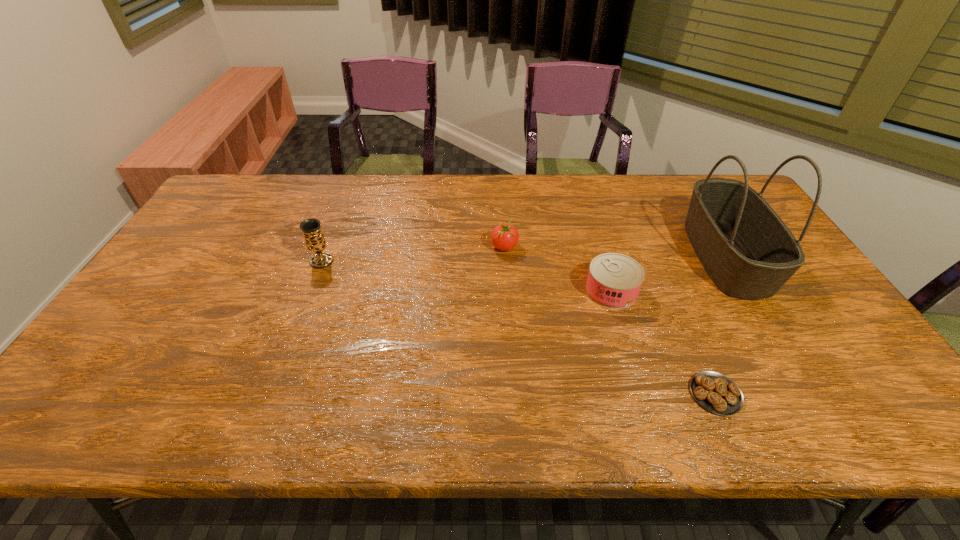
What are the coordinates of `free location located 0.340m on the front of the fourth object from right to left` in the screenshot? It's located at (511, 348).

Where is `vacant space situated 0.380m on the right of the can`? vacant space situated 0.380m on the right of the can is located at coordinates (775, 291).

Where is `free space located 0.160m on the left of the pastry`? free space located 0.160m on the left of the pastry is located at coordinates (619, 394).

Identify the location of object that is at the near edge. This screenshot has height=540, width=960. (715, 392).

Where is `object located in the right edge section of the desktop`? This screenshot has height=540, width=960. object located in the right edge section of the desktop is located at coordinates (747, 250).

This screenshot has height=540, width=960. Find the location of `vacant space at the far edge of the desktop`. vacant space at the far edge of the desktop is located at coordinates (565, 194).

I want to click on vacant space at the near edge of the desktop, so click(x=619, y=422).

Locate an element on the screen. The width and height of the screenshot is (960, 540). vacant space at the left edge is located at coordinates (166, 300).

Locate an element on the screen. The height and width of the screenshot is (540, 960). free space at the right edge is located at coordinates (800, 335).

This screenshot has height=540, width=960. In the image, there is a desktop. Find the location of `free space at the far left corner`. free space at the far left corner is located at coordinates (231, 187).